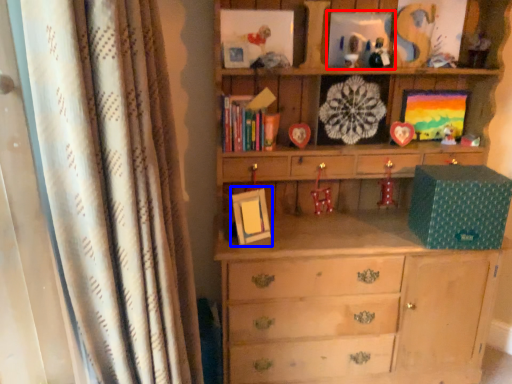
Question: Which point is closer to the camera, picture frame (highlighted by a red box) or picture frame (highlighted by a blue box)?

Choices:
 (A) picture frame
 (B) picture frame

Answer: (B)